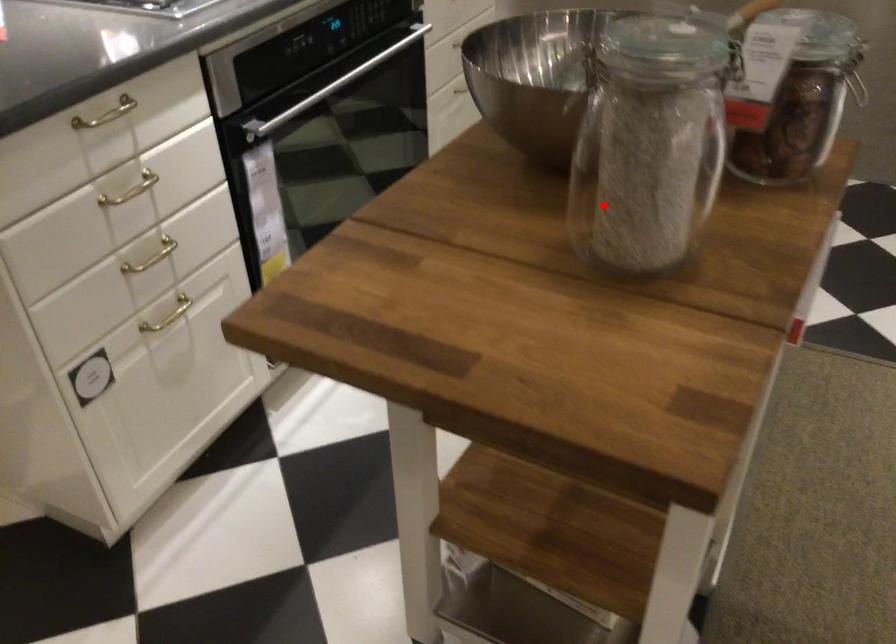
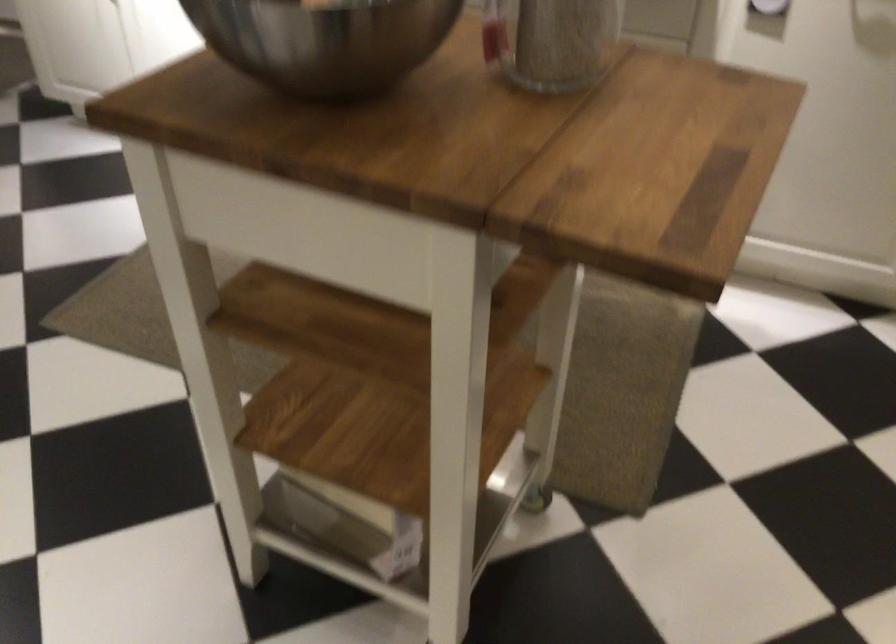
Locate, in the second image, the point that corresponds to the highlighted location in the first image.

(553, 41)